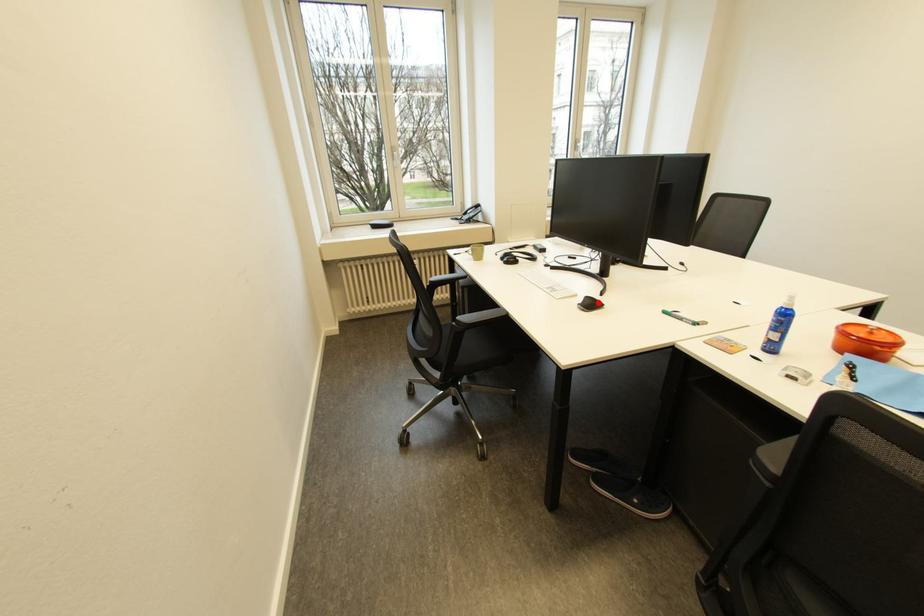
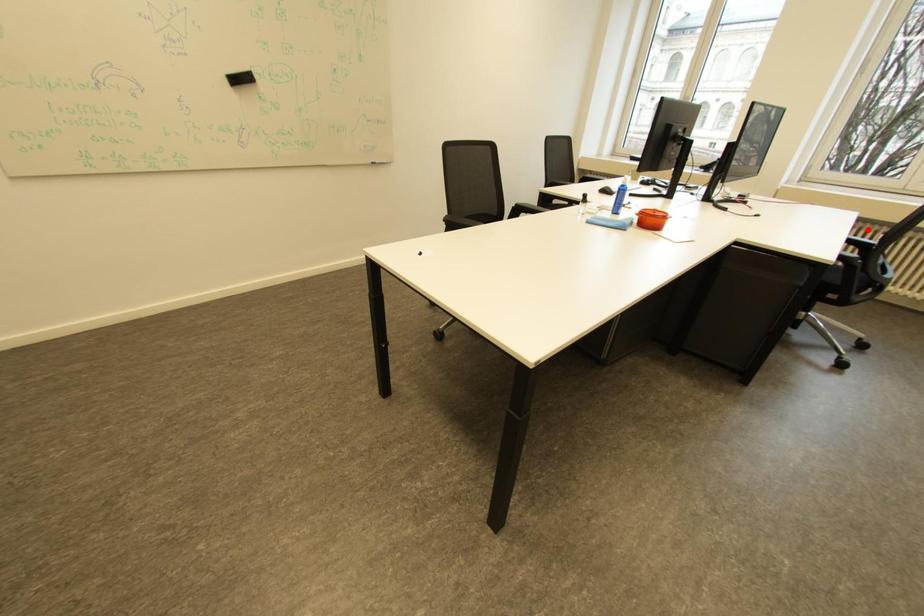
I am providing you with two images of the same scene from different viewpoints. A red point is marked on the first image and another point is marked on the second image. Is the marked point in image1 the same physical position as the marked point in image2?

No